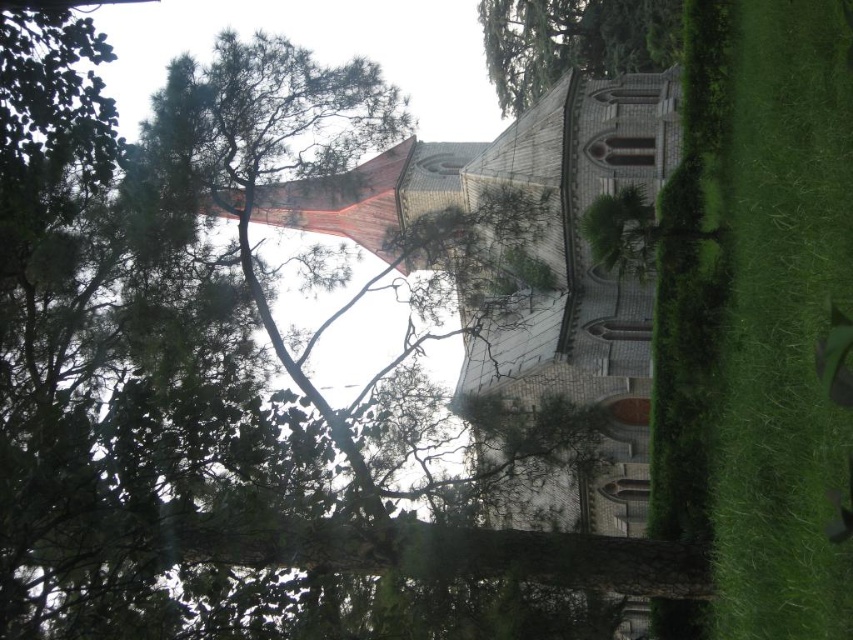
You are standing in the churchyard and want to walk towards the green textured tree at upper center. As you walk, you notice the green grass at lower right. Which area will you step on first?

You will step on the green grass at lower right first because it is closer to your starting position in the churchyard than the green textured tree at upper center.

You are standing at the point marked by the coordinates point [756,321]. Looking around, you see the church with its red brick spire and the surrounding trees. Which direction should you face to see the green grass at lower right?

The point [756,321] marks the green grass at lower right, so you are already standing on the green grass at lower right. Therefore, you don not need to face any particular direction to see it.